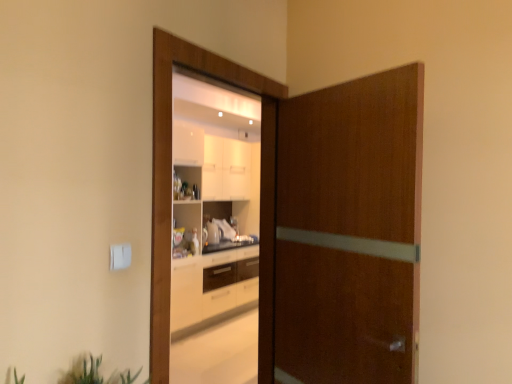
Question: Is wooden door at center, which is the 2th screen door in right-to-left order, thinner than green leafy plant at lower left?

Choices:
 (A) yes
 (B) no

Answer: (A)

Question: Considering the relative sizes of wooden door at center, which is the 2th screen door in right-to-left order, and green leafy plant at lower left in the image provided, is wooden door at center, which is the 2th screen door in right-to-left order, smaller than green leafy plant at lower left?

Choices:
 (A) no
 (B) yes

Answer: (A)

Question: Can you confirm if wooden door at center, marked as the 1th screen door in a left-to-right arrangement, is positioned to the left of green leafy plant at lower left?

Choices:
 (A) yes
 (B) no

Answer: (B)

Question: Does wooden door at center, which is the 2th screen door in right-to-left order, touch green leafy plant at lower left?

Choices:
 (A) yes
 (B) no

Answer: (B)

Question: Is green leafy plant at lower left inside wooden door at center, which is the 2th screen door in right-to-left order?

Choices:
 (A) yes
 (B) no

Answer: (B)

Question: Looking at their shapes, would you say brown wood door at center, the first screen door positioned from the right, is wider or thinner than wooden door at center, which is the 2th screen door in right-to-left order?

Choices:
 (A) thin
 (B) wide

Answer: (B)

Question: From the image's perspective, is brown wood door at center, the 2th screen door viewed from the left, located above or below wooden door at center, which is the 2th screen door in right-to-left order?

Choices:
 (A) above
 (B) below

Answer: (B)

Question: Choose the correct answer: Is brown wood door at center, the 2th screen door viewed from the left, inside wooden door at center, marked as the 1th screen door in a left-to-right arrangement, or outside it?

Choices:
 (A) outside
 (B) inside

Answer: (A)

Question: In terms of size, does brown wood door at center, the 2th screen door viewed from the left, appear bigger or smaller than wooden door at center, marked as the 1th screen door in a left-to-right arrangement?

Choices:
 (A) small
 (B) big

Answer: (B)

Question: In terms of size, does brown wood door at center, the first screen door positioned from the right, appear bigger or smaller than green leafy plant at lower left?

Choices:
 (A) small
 (B) big

Answer: (B)

Question: Is brown wood door at center, the first screen door positioned from the right, in front of or behind green leafy plant at lower left in the image?

Choices:
 (A) behind
 (B) front

Answer: (A)

Question: From the image's perspective, is brown wood door at center, the first screen door positioned from the right, above or below green leafy plant at lower left?

Choices:
 (A) below
 (B) above

Answer: (B)

Question: From their relative heights in the image, would you say brown wood door at center, the 2th screen door viewed from the left, is taller or shorter than green leafy plant at lower left?

Choices:
 (A) tall
 (B) short

Answer: (A)

Question: Considering the positions of green leafy plant at lower left and wooden door at center, marked as the 1th screen door in a left-to-right arrangement, in the image, is green leafy plant at lower left bigger or smaller than wooden door at center, marked as the 1th screen door in a left-to-right arrangement,?

Choices:
 (A) small
 (B) big

Answer: (A)

Question: Is green leafy plant at lower left inside the boundaries of wooden door at center, marked as the 1th screen door in a left-to-right arrangement, or outside?

Choices:
 (A) inside
 (B) outside

Answer: (B)